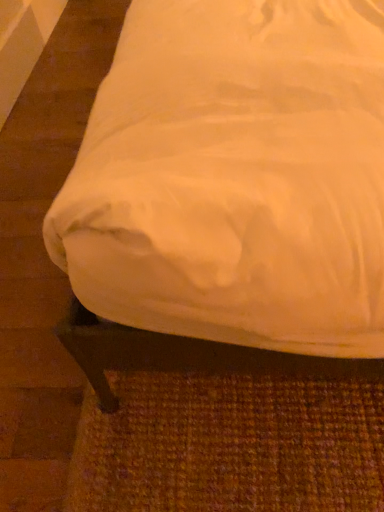
The width and height of the screenshot is (384, 512). I want to click on white fabric bed at upper center, so click(x=227, y=197).

What do you see at coordinates (227, 197) in the screenshot? Image resolution: width=384 pixels, height=512 pixels. I see `white fabric bed at upper center` at bounding box center [227, 197].

In order to face white fabric bed at upper center, should I rotate leftwards or rightwards?

Turn left approximately 4.152 degrees to face it.

Find the location of a particular element. This screenshot has width=384, height=512. white fabric bed at upper center is located at coordinates (227, 197).